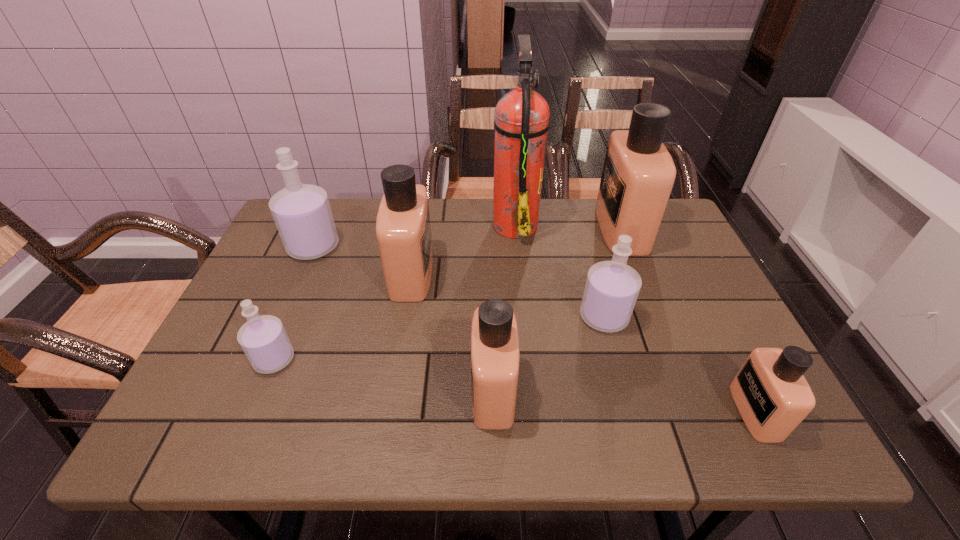
Where is `the tallest object`? Image resolution: width=960 pixels, height=540 pixels. the tallest object is located at coordinates (521, 123).

Where is `the second beige perfume from right to left`? The width and height of the screenshot is (960, 540). the second beige perfume from right to left is located at coordinates (638, 174).

You are a GUI agent. You are given a task and a screenshot of the screen. Output one action in this format:
    pyautogui.click(x=<x>, y=<y>)
    Task: Click on the seventh object from left to right
    
    Given the screenshot: What is the action you would take?
    pyautogui.click(x=638, y=174)

This screenshot has height=540, width=960. Identify the location of the fifth perfume from right to left. (403, 230).

This screenshot has height=540, width=960. Identify the location of the second biggest beige perfume. (403, 230).

Locate an element on the screen. This screenshot has width=960, height=540. the farthest purple perfume is located at coordinates (302, 214).

This screenshot has width=960, height=540. I want to click on the rightmost purple perfume, so click(x=612, y=287).

At what (x,y) coordinates should I click in order to perform the action: click on the second biggest purple perfume. Please return your answer as a coordinate pair (x, y). Looking at the image, I should click on (612, 287).

Where is `the fourth perfume from left to right`? Image resolution: width=960 pixels, height=540 pixels. the fourth perfume from left to right is located at coordinates (495, 358).

At what (x,y) coordinates should I click in order to perform the action: click on the third beige perfume from right to left. Please return your answer as a coordinate pair (x, y). The image size is (960, 540). Looking at the image, I should click on (495, 358).